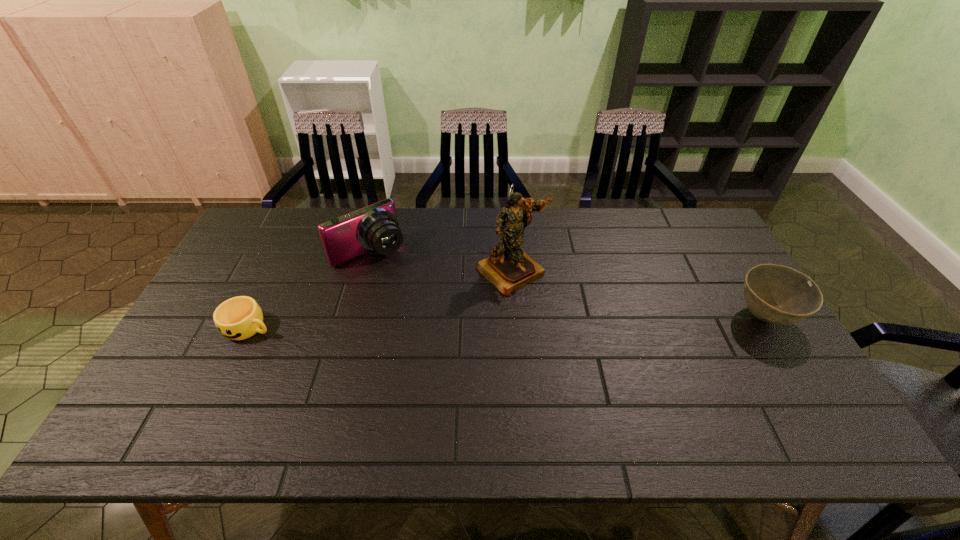
Locate an element on the screen. The height and width of the screenshot is (540, 960). unoccupied position between the bowl and the shortest object is located at coordinates (507, 322).

Identify the location of free space that is in between the rightmost object and the third object from right to left. The height and width of the screenshot is (540, 960). (567, 285).

The height and width of the screenshot is (540, 960). What are the coordinates of `empty location between the bowl and the third object from right to left` in the screenshot? It's located at (567, 285).

Locate an element on the screen. This screenshot has width=960, height=540. free space between the cup and the third object from left to right is located at coordinates (380, 299).

Identify the location of free space between the camera and the third tallest object. (567, 285).

This screenshot has width=960, height=540. Find the location of `object that is the second closest one to the figurine`. object that is the second closest one to the figurine is located at coordinates (775, 294).

Locate which object is the third closest to the cup. Please provide its 2D coordinates. Your answer should be formatted as a tuple, i.e. [(x, y)], where the tuple contains the x and y coordinates of a point satisfying the conditions above.

[(775, 294)]

Identify the location of vacant space that satisfies the following two spatial constraints: 1. on the front side of the third object from left to right; 2. on the left side of the rightmost object. The height and width of the screenshot is (540, 960). (515, 317).

Identify the location of free space that satisfies the following two spatial constraints: 1. on the front side of the tallest object; 2. on the right side of the rightmost object. This screenshot has height=540, width=960. (515, 317).

What are the coordinates of `vacant space that satisfies the following two spatial constraints: 1. on the back side of the second tallest object; 2. on the left side of the shortest object` in the screenshot? It's located at (286, 252).